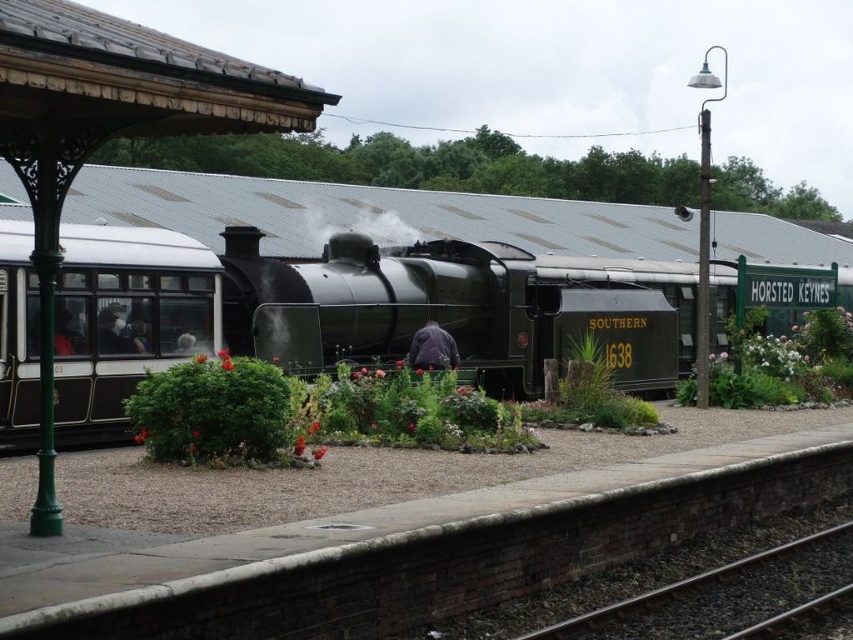
Who is lower down, polished black steam locomotive at center or matte black passenger car at left?

matte black passenger car at left is below.

Between point (577, 304) and point (35, 438), which one is positioned in front?

Positioned in front is point (35, 438).

The width and height of the screenshot is (853, 640). What do you see at coordinates (347, 310) in the screenshot? I see `polished black steam locomotive at center` at bounding box center [347, 310].

Where is `polished black steam locomotive at center`? This screenshot has height=640, width=853. polished black steam locomotive at center is located at coordinates (347, 310).

Can you confirm if polished black steam locomotive at center is thinner than white matte steam at center?

In fact, polished black steam locomotive at center might be wider than white matte steam at center.

Does polished black steam locomotive at center come behind white matte steam at center?

That is False.

The height and width of the screenshot is (640, 853). I want to click on polished black steam locomotive at center, so click(347, 310).

Does point (53, 353) come farther from viewer compared to point (538, 630)?

Yes, point (53, 353) is farther from viewer.

Between matte black passenger car at left and black gravel train track at lower right, which one has less height?

Standing shorter between the two is black gravel train track at lower right.

Locate an element on the screen. The height and width of the screenshot is (640, 853). matte black passenger car at left is located at coordinates pos(126,317).